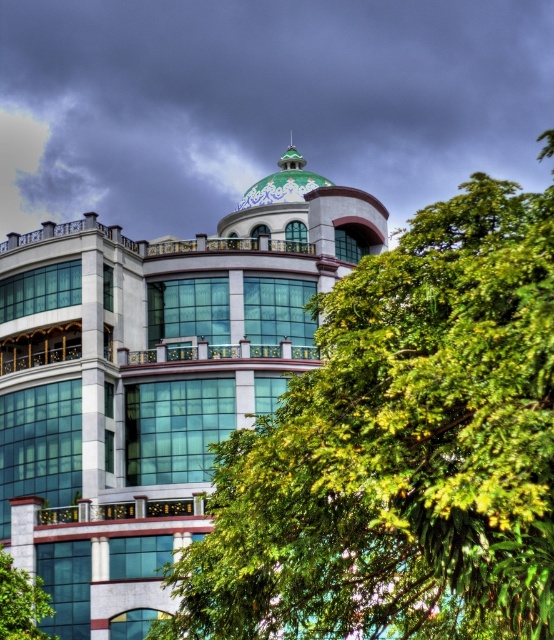
Is green leafy tree at upper center shorter than green glossy dome at upper center?

Incorrect, green leafy tree at upper center's height does not fall short of green glossy dome at upper center's.

The height and width of the screenshot is (640, 554). What do you see at coordinates (399, 451) in the screenshot?
I see `green leafy tree at upper center` at bounding box center [399, 451].

You are a GUI agent. You are given a task and a screenshot of the screen. Output one action in this format:
    pyautogui.click(x=<x>, y=<y>)
    Task: Click on the green leafy tree at upper center
    This screenshot has width=554, height=640.
    Given the screenshot: What is the action you would take?
    pyautogui.click(x=399, y=451)

Is green glossy dome at upper center positioned at the back of green glass building at center?

Yes, it is.

Does green glossy dome at upper center appear over green glass building at center?

Yes, green glossy dome at upper center is above green glass building at center.

Where is `green glossy dome at upper center`? Image resolution: width=554 pixels, height=640 pixels. green glossy dome at upper center is located at coordinates (263, 100).

Between green leafy tree at upper center and green glass building at center, which one appears on the right side from the viewer's perspective?

green leafy tree at upper center

Measure the distance between point (458, 204) and camera.

Point (458, 204) is 38.97 meters away from camera.

You are a GUI agent. You are given a task and a screenshot of the screen. Output one action in this format:
    pyautogui.click(x=<x>, y=<y>)
    Task: Click on the green leafy tree at upper center
    
    Given the screenshot: What is the action you would take?
    pyautogui.click(x=399, y=451)